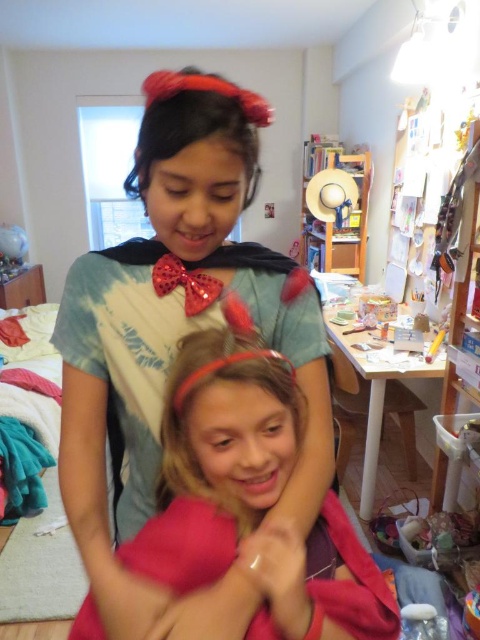
You are a photographer standing in the room. You want to take a photo of the two children. The camera you are using has a minimum focus distance of 60 centimeters. Will the point at point (156, 612) be in focus?

The point at point (156, 612) is 57.40 centimeters from the camera, which is closer than the minimum focus distance of 60 centimeters. Therefore, the point will not be in focus.

You are a fashion designer looking at the two accessories in the image. The matte red headband at upper center and the shiny sequined bow tie at center. Which accessory has a greater width?

The matte red headband at upper center has a greater width than the shiny sequined bow tie at center.

Consider the image. You are a photographer trying to capture a candid shot of the two children in the scene. The camera is positioned at the point with coordinates point (195,122). Which object is directly in front of the camera?

The point (195,122) corresponds to the matte red headband at upper center, so the camera is directly facing the matte red headband at upper center.